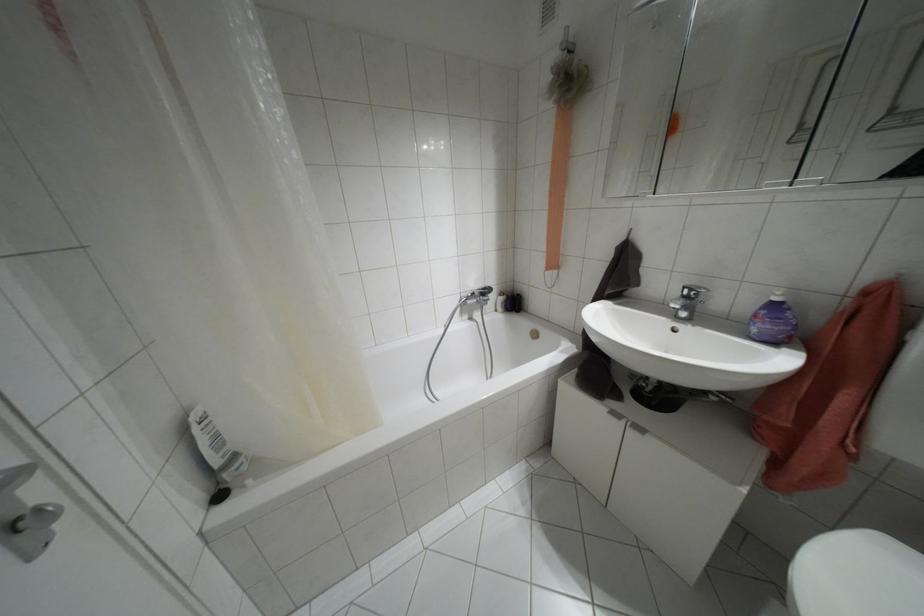
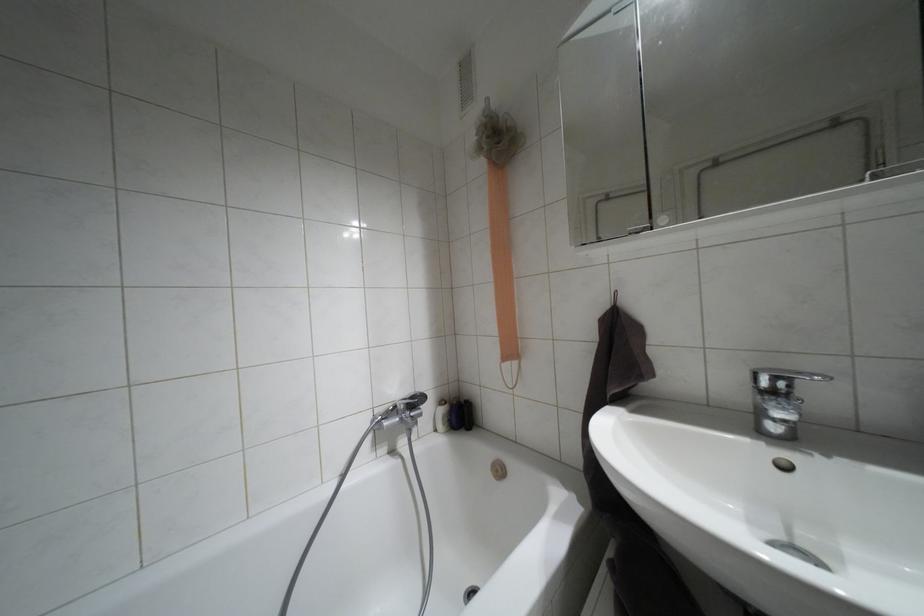
Question: The first image is from the beginning of the video and the second image is from the end. How did the camera likely rotate when shooting the video?

Choices:
 (A) Left
 (B) Right
 (C) Up
 (D) Down

Answer: (C)